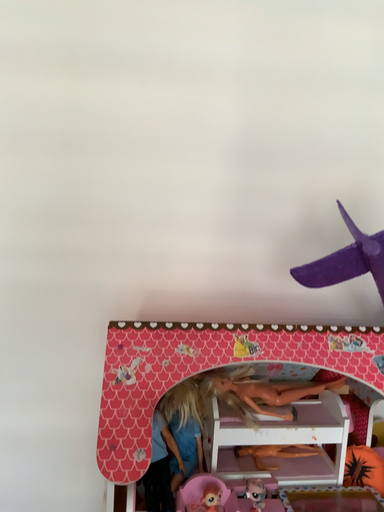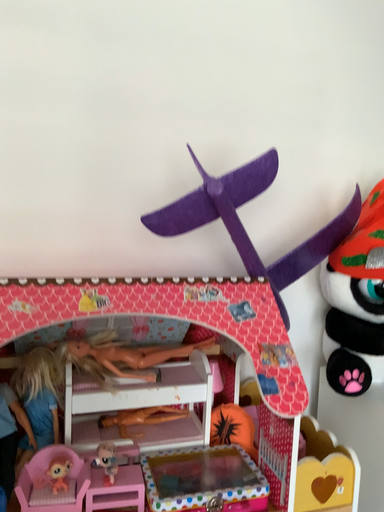
Question: How did the camera likely rotate when shooting the video?

Choices:
 (A) rotated right
 (B) rotated left

Answer: (A)